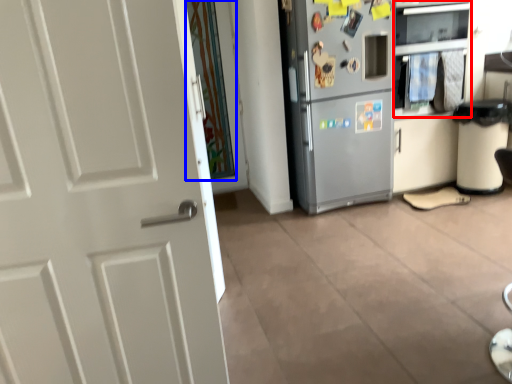
Question: Among these objects, which one is nearest to the camera, oven (highlighted by a red box) or glass door (highlighted by a blue box)?

Choices:
 (A) oven
 (B) glass door

Answer: (A)